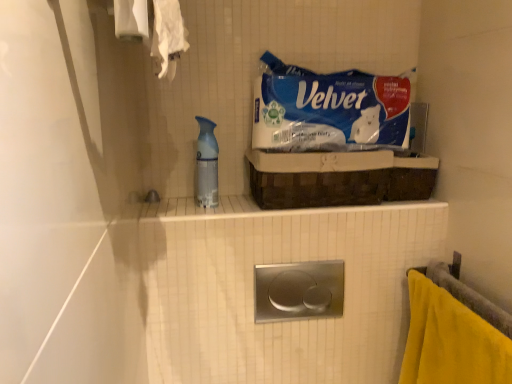
Question: Is translucent plastic spray bottle at center positioned beyond the bounds of polished stainless steel flush plate at center?

Choices:
 (A) yes
 (B) no

Answer: (A)

Question: Is translucent plastic spray bottle at center positioned before polished stainless steel flush plate at center?

Choices:
 (A) no
 (B) yes

Answer: (A)

Question: Does translucent plastic spray bottle at center touch polished stainless steel flush plate at center?

Choices:
 (A) yes
 (B) no

Answer: (B)

Question: Is translucent plastic spray bottle at center smaller than polished stainless steel flush plate at center?

Choices:
 (A) no
 (B) yes

Answer: (B)

Question: Does translucent plastic spray bottle at center appear on the left side of polished stainless steel flush plate at center?

Choices:
 (A) no
 (B) yes

Answer: (B)

Question: From a real-world perspective, is translucent plastic spray bottle at center beneath polished stainless steel flush plate at center?

Choices:
 (A) yes
 (B) no

Answer: (B)

Question: Considering the relative sizes of brown woven basket at upper center and translucent plastic spray bottle at center in the image provided, is brown woven basket at upper center wider than translucent plastic spray bottle at center?

Choices:
 (A) no
 (B) yes

Answer: (B)

Question: Is brown woven basket at upper center completely or partially outside of translucent plastic spray bottle at center?

Choices:
 (A) yes
 (B) no

Answer: (A)

Question: Is brown woven basket at upper center with translucent plastic spray bottle at center?

Choices:
 (A) no
 (B) yes

Answer: (A)

Question: Is brown woven basket at upper center positioned before translucent plastic spray bottle at center?

Choices:
 (A) no
 (B) yes

Answer: (B)

Question: Would you consider brown woven basket at upper center to be distant from translucent plastic spray bottle at center?

Choices:
 (A) yes
 (B) no

Answer: (B)

Question: Is brown woven basket at upper center taller than translucent plastic spray bottle at center?

Choices:
 (A) no
 (B) yes

Answer: (A)

Question: Is translucent plastic spray bottle at center to the right of yellow fabric towel at lower right from the viewer's perspective?

Choices:
 (A) yes
 (B) no

Answer: (B)